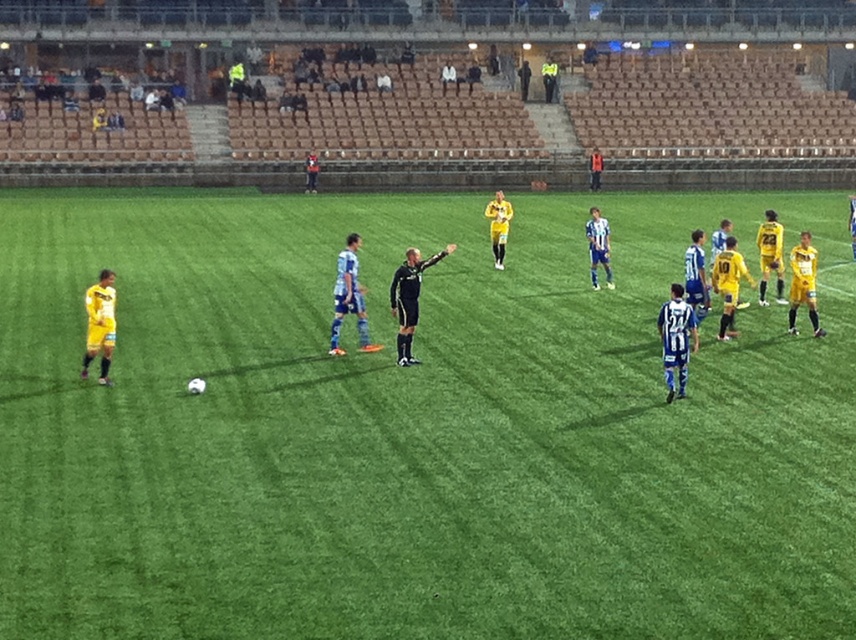
Question: Can you confirm if yellow jersey at center is bigger than black smooth referee at center?

Choices:
 (A) no
 (B) yes

Answer: (B)

Question: Is green artificial turf at center smaller than yellow jersey at center?

Choices:
 (A) no
 (B) yes

Answer: (A)

Question: Which object is the closest to the yellow jersey at center?

Choices:
 (A) black smooth referee at center
 (B) green artificial turf at center

Answer: (B)

Question: Which of these objects is positioned farthest from the green artificial turf at center?

Choices:
 (A) black smooth referee at center
 (B) yellow jersey at center

Answer: (A)

Question: Which point appears closest to the camera in this image?

Choices:
 (A) (150, 342)
 (B) (611, 275)

Answer: (A)

Question: Does yellow jersey at center have a lesser width compared to black smooth referee at center?

Choices:
 (A) yes
 (B) no

Answer: (B)